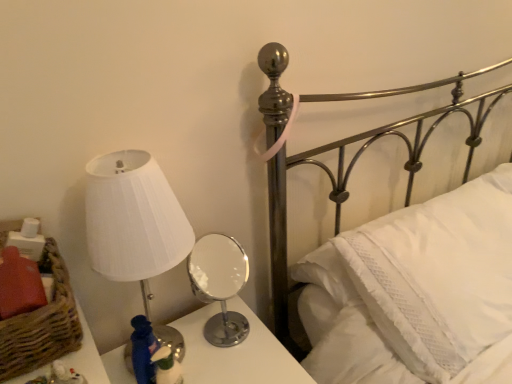
The height and width of the screenshot is (384, 512). Find the location of `empty space that is ontop of white pleated fabric lampshade at left (from a real-world perspective)`. empty space that is ontop of white pleated fabric lampshade at left (from a real-world perspective) is located at coordinates (110, 164).